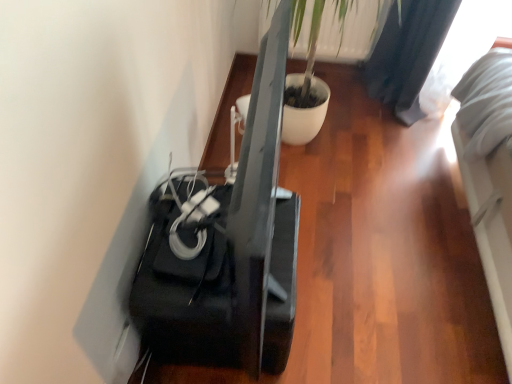
The height and width of the screenshot is (384, 512). Identify the location of black glossy speaker at lower left. (227, 112).

What do you see at coordinates (227, 112) in the screenshot? I see `black glossy speaker at lower left` at bounding box center [227, 112].

Locate an element on the screen. green leafy plant at upper center is located at coordinates click(314, 29).

Measure the distance between point (x=378, y=14) and camera.

Point (x=378, y=14) is 1.96 meters from camera.

Image resolution: width=512 pixels, height=384 pixels. What do you see at coordinates (314, 29) in the screenshot? I see `green leafy plant at upper center` at bounding box center [314, 29].

Identify the location of black glossy speaker at lower left. (227, 112).

Does green leafy plant at upper center appear on the right side of black glossy speaker at lower left?

Indeed, green leafy plant at upper center is positioned on the right side of black glossy speaker at lower left.

Relative to black glossy speaker at lower left, is green leafy plant at upper center in front or behind?

Clearly, green leafy plant at upper center is behind black glossy speaker at lower left.

Considering the positions of points (339, 10) and (237, 65), is point (339, 10) closer to camera compared to point (237, 65)?

Yes, it is.

From the image's perspective, is green leafy plant at upper center under black glossy speaker at lower left?

Actually, green leafy plant at upper center appears above black glossy speaker at lower left in the image.

From a real-world perspective, is green leafy plant at upper center positioned over black glossy speaker at lower left based on gravity?

Yes, from a real-world perspective, green leafy plant at upper center is over black glossy speaker at lower left

Considering the sizes of objects green leafy plant at upper center and black glossy speaker at lower left in the image provided, who is wider, green leafy plant at upper center or black glossy speaker at lower left?

black glossy speaker at lower left is wider.

Considering the relative sizes of green leafy plant at upper center and black glossy speaker at lower left in the image provided, is green leafy plant at upper center taller than black glossy speaker at lower left?

Incorrect, the height of green leafy plant at upper center is not larger of that of black glossy speaker at lower left.

Considering the sizes of green leafy plant at upper center and black glossy speaker at lower left in the image, is green leafy plant at upper center bigger or smaller than black glossy speaker at lower left?

green leafy plant at upper center is smaller than black glossy speaker at lower left.

Do you think green leafy plant at upper center is within black glossy speaker at lower left, or outside of it?

green leafy plant at upper center is not enclosed by black glossy speaker at lower left.

Looking at this image, is the surface of green leafy plant at upper center in direct contact with black glossy speaker at lower left?

No, green leafy plant at upper center is not touching black glossy speaker at lower left.

Is green leafy plant at upper center facing towards black glossy speaker at lower left?

Yes, green leafy plant at upper center faces towards black glossy speaker at lower left.

How distant is green leafy plant at upper center from black glossy speaker at lower left?

green leafy plant at upper center and black glossy speaker at lower left are 44.49 centimeters apart.

There is a black glossy speaker at lower left. What are the coordinates of `plant above it (from a real-world perspective)` in the screenshot? It's located at (314, 29).

Between black glossy speaker at lower left and green leafy plant at upper center, which one appears on the right side from the viewer's perspective?

Positioned to the right is green leafy plant at upper center.

Relative to green leafy plant at upper center, is black glossy speaker at lower left in front or behind?

black glossy speaker at lower left is positioned closer to the viewer than green leafy plant at upper center.

Based on the photo, which is farther, (295,160) or (341,32)?

The point (341,32) is behind.

From the image's perspective, is black glossy speaker at lower left on top of green leafy plant at upper center?

No, from the image's perspective, black glossy speaker at lower left is not on top of green leafy plant at upper center.

From a real-world perspective, is black glossy speaker at lower left over green leafy plant at upper center?

No, from a real-world perspective, black glossy speaker at lower left is not above green leafy plant at upper center.

Can you confirm if black glossy speaker at lower left is thinner than green leafy plant at upper center?

No, black glossy speaker at lower left is not thinner than green leafy plant at upper center.

Which of these two, black glossy speaker at lower left or green leafy plant at upper center, stands shorter?

green leafy plant at upper center is shorter.

Is black glossy speaker at lower left bigger than green leafy plant at upper center?

Yes.

Is black glossy speaker at lower left positioned beyond the bounds of green leafy plant at upper center?

Yes, black glossy speaker at lower left is outside of green leafy plant at upper center.

Is black glossy speaker at lower left not close to green leafy plant at upper center?

No.

Could you tell me if black glossy speaker at lower left is turned towards green leafy plant at upper center?

No.

How different are the orientations of black glossy speaker at lower left and green leafy plant at upper center in degrees?

The angular difference between black glossy speaker at lower left and green leafy plant at upper center is 91.1 degrees.

Measure the distance from black glossy speaker at lower left to green leafy plant at upper center.

44.49 centimeters.

The image size is (512, 384). Identify the location of plant that is on the right side of black glossy speaker at lower left. (314, 29).

Where is `furniture located underneath the green leafy plant at upper center (from a real-world perspective)`? This screenshot has height=384, width=512. furniture located underneath the green leafy plant at upper center (from a real-world perspective) is located at coordinates (227, 112).

You are a GUI agent. You are given a task and a screenshot of the screen. Output one action in this format:
    pyautogui.click(x=<x>, y=<y>)
    Task: Click on the plant located above the black glossy speaker at lower left (from a real-world perspective)
    This screenshot has height=384, width=512.
    Given the screenshot: What is the action you would take?
    pyautogui.click(x=314, y=29)